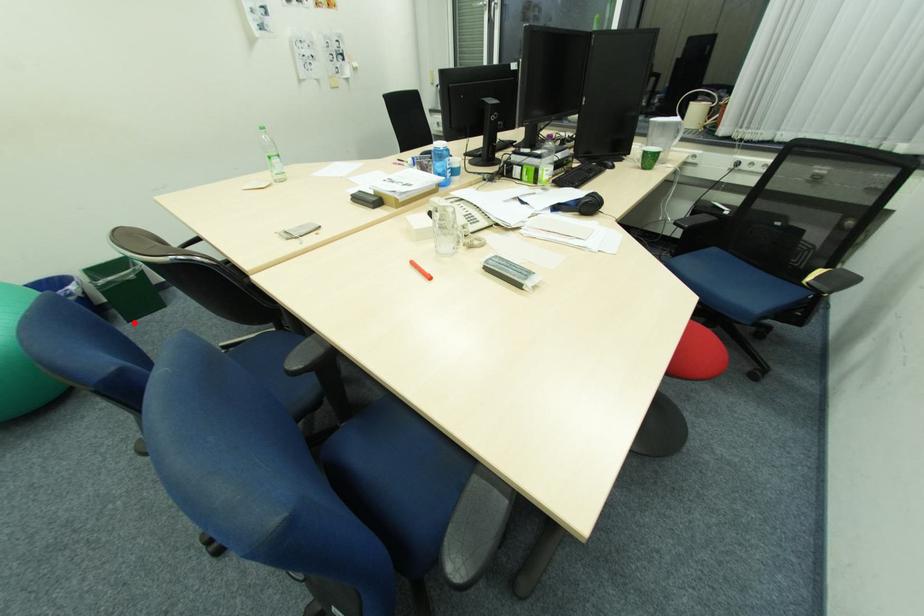
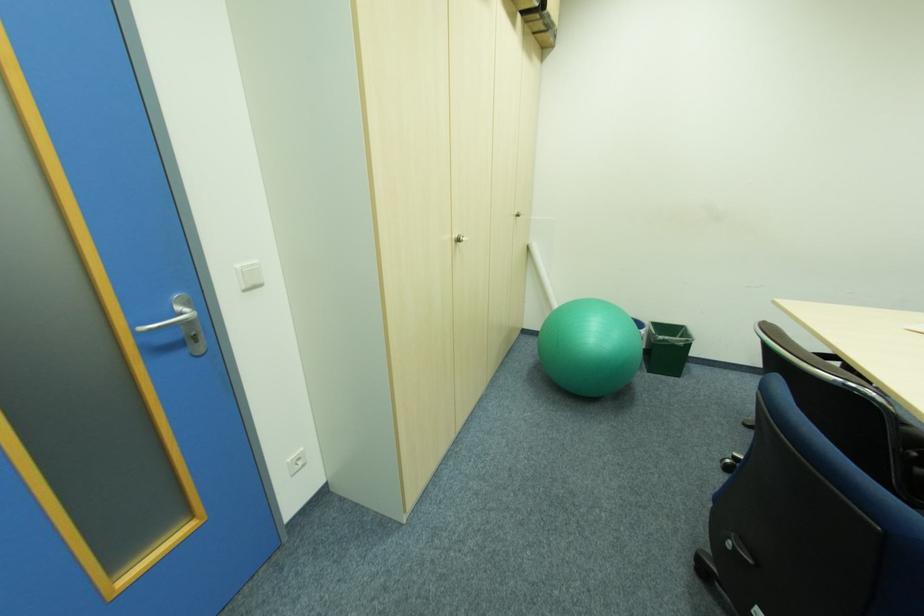
Question: I am providing you with two images of the same scene from different viewpoints. A red point is shown in image1. For the corresponding object point in image2, is it positioned nearer or farther from the camera?

Choices:
 (A) Nearer
 (B) Farther

Answer: (B)